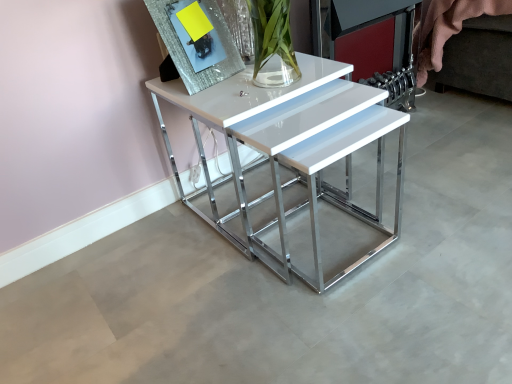
What are the coordinates of `free point in front of white glossy table at center` in the screenshot? It's located at (307, 314).